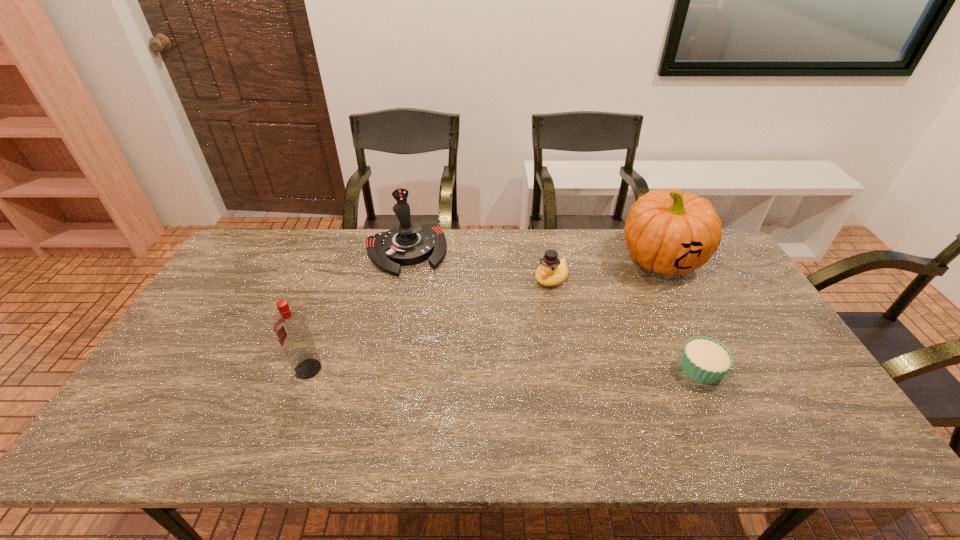
The width and height of the screenshot is (960, 540). Identify the location of vodka. (292, 330).

Identify the location of cupcake. (704, 360).

You are a GUI agent. You are given a task and a screenshot of the screen. Output one action in this format:
    pyautogui.click(x=<x>, y=<y>)
    Task: Click on the fourth object from right to left
    This screenshot has width=960, height=540.
    Given the screenshot: What is the action you would take?
    pyautogui.click(x=410, y=243)

Identify the location of duck. (552, 271).

I want to click on the third object from right to left, so click(x=552, y=271).

Where is `pumpkin`? This screenshot has width=960, height=540. pumpkin is located at coordinates (667, 232).

Locate an element on the screen. The width and height of the screenshot is (960, 540). vacant space located on the front label of the vodka is located at coordinates tap(236, 369).

The image size is (960, 540). What are the coordinates of `vacant space located 0.320m on the front label of the vodka` in the screenshot? It's located at (172, 369).

I want to click on vacant space positioned 0.330m on the front label of the vodka, so click(x=168, y=369).

The image size is (960, 540). What are the coordinates of `blank space located 0.160m on the back of the cupcake` in the screenshot? It's located at (673, 309).